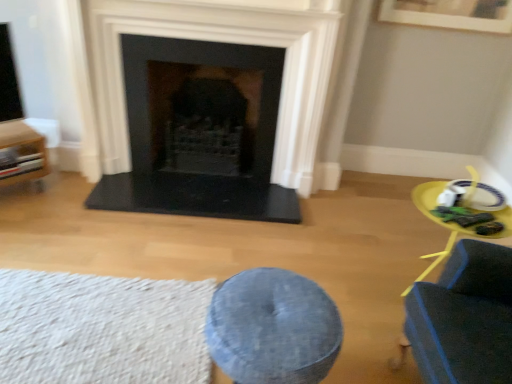
This screenshot has height=384, width=512. I want to click on vacant region above denim cushion at center (from a real-world perspective), so click(x=279, y=304).